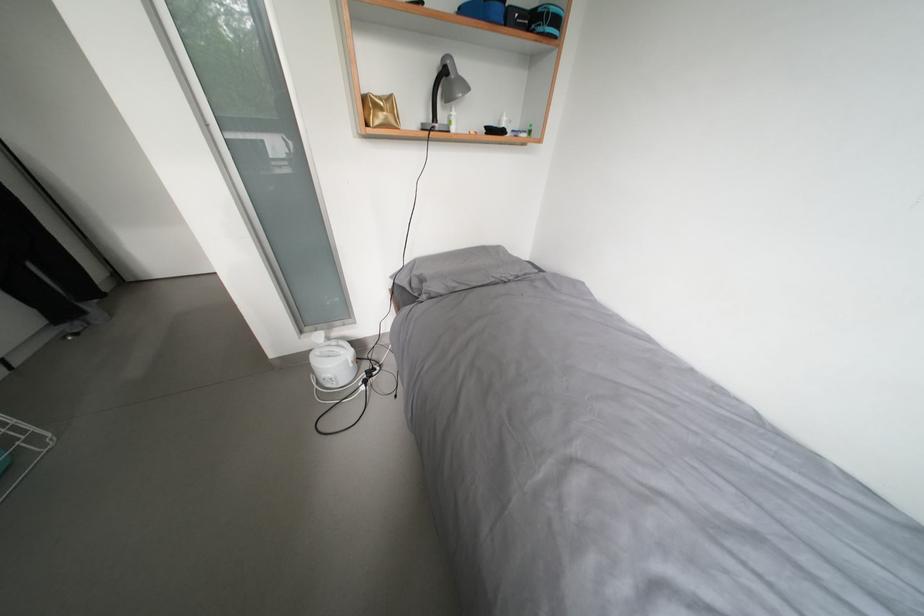
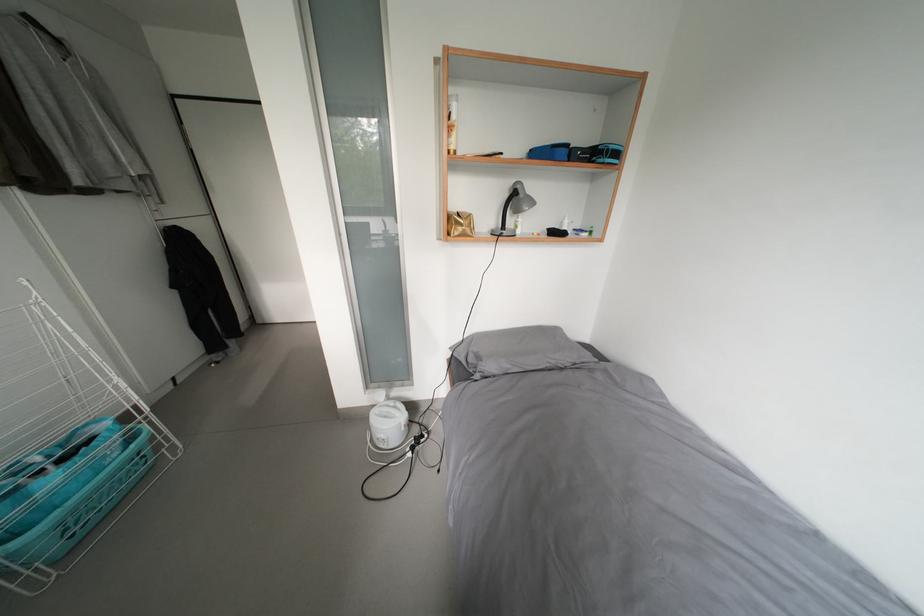
In the second image, find the point that corresponds to (453,127) in the first image.

(519, 232)